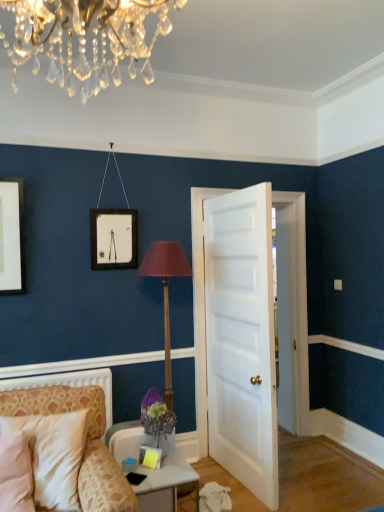
Question: Is wooden table lamp at center behind white glossy table at lower center?

Choices:
 (A) no
 (B) yes

Answer: (B)

Question: Can you confirm if wooden table lamp at center is positioned to the left of white glossy table at lower center?

Choices:
 (A) yes
 (B) no

Answer: (B)

Question: From the image's perspective, is wooden table lamp at center on white glossy table at lower center?

Choices:
 (A) yes
 (B) no

Answer: (A)

Question: Does wooden table lamp at center have a lesser height compared to white glossy table at lower center?

Choices:
 (A) yes
 (B) no

Answer: (B)

Question: From the image's perspective, is wooden table lamp at center under white glossy table at lower center?

Choices:
 (A) no
 (B) yes

Answer: (A)

Question: Is white glossy table at lower center situated inside wooden table lamp at center or outside?

Choices:
 (A) outside
 (B) inside

Answer: (A)

Question: From a real-world perspective, is white glossy table at lower center physically located above or below wooden table lamp at center?

Choices:
 (A) below
 (B) above

Answer: (A)

Question: Considering their positions, is white glossy table at lower center located in front of or behind wooden table lamp at center?

Choices:
 (A) front
 (B) behind

Answer: (A)

Question: Considering the positions of white glossy table at lower center and wooden table lamp at center in the image, is white glossy table at lower center wider or thinner than wooden table lamp at center?

Choices:
 (A) thin
 (B) wide

Answer: (A)

Question: Is wooden table lamp at center to the left or to the right of patterned fabric chair at lower left in the image?

Choices:
 (A) right
 (B) left

Answer: (A)

Question: Considering their positions, is wooden table lamp at center located in front of or behind patterned fabric chair at lower left?

Choices:
 (A) front
 (B) behind

Answer: (B)

Question: Is wooden table lamp at center wider or thinner than patterned fabric chair at lower left?

Choices:
 (A) wide
 (B) thin

Answer: (A)

Question: Choose the correct answer: Is wooden table lamp at center inside patterned fabric chair at lower left or outside it?

Choices:
 (A) outside
 (B) inside

Answer: (A)

Question: Considering the positions of wooden table lamp at center and white glossy table at lower center in the image, is wooden table lamp at center wider or thinner than white glossy table at lower center?

Choices:
 (A) wide
 (B) thin

Answer: (A)

Question: From the image's perspective, is wooden table lamp at center above or below white glossy table at lower center?

Choices:
 (A) above
 (B) below

Answer: (A)